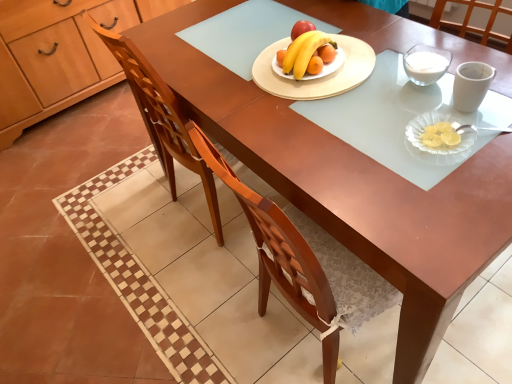
You are a GUI agent. You are given a task and a screenshot of the screen. Output one action in this format:
    pyautogui.click(x=<x>, y=<y>)
    Task: Click on the vacant region in front of wooden round platter at center, which ranks as the first platter in back-to-front order
    This screenshot has height=384, width=512.
    Given the screenshot: What is the action you would take?
    (340, 125)